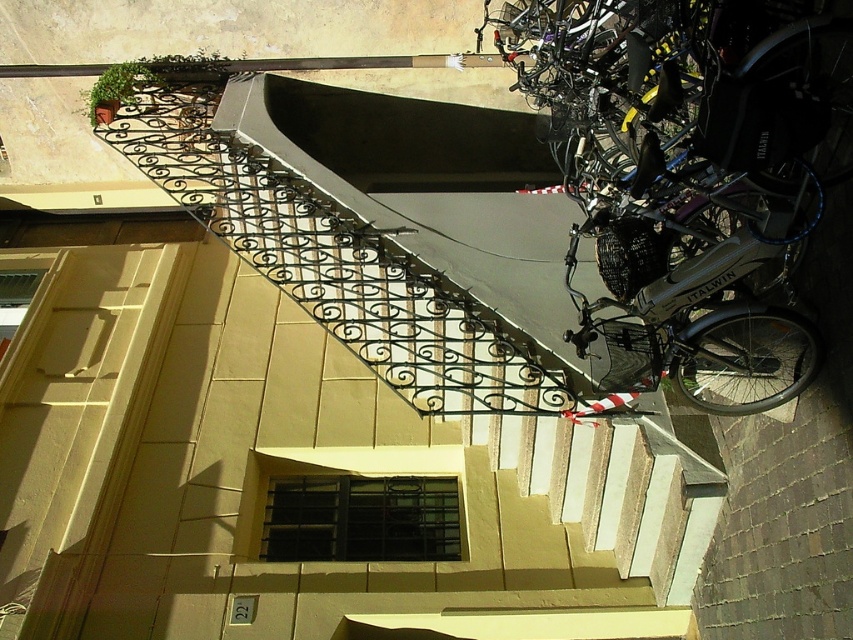
Question: Is smooth concrete stairs at center behind silver metallic bicycle at right?

Choices:
 (A) yes
 (B) no

Answer: (A)

Question: Is smooth concrete stairs at center wider than silver metallic bicycle at right?

Choices:
 (A) no
 (B) yes

Answer: (B)

Question: Among these points, which one is farthest from the camera?

Choices:
 (A) (260, 470)
 (B) (583, 113)

Answer: (A)

Question: Which point is closer to the camera?

Choices:
 (A) smooth concrete stairs at center
 (B) silver metallic bicycle at right

Answer: (B)

Question: Which point appears farthest from the camera in this image?

Choices:
 (A) (746, 193)
 (B) (624, 609)

Answer: (B)

Question: Considering the relative positions of smooth concrete stairs at center and silver metallic bicycle at right in the image provided, where is smooth concrete stairs at center located with respect to silver metallic bicycle at right?

Choices:
 (A) right
 (B) left

Answer: (B)